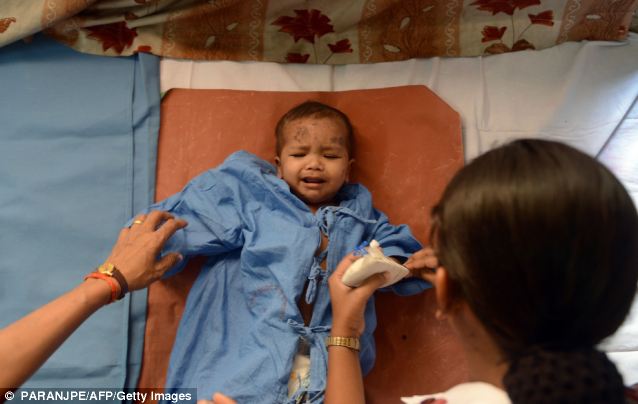
The height and width of the screenshot is (404, 638). What are the coordinates of `orange sheet` in the screenshot? It's located at (404, 135).